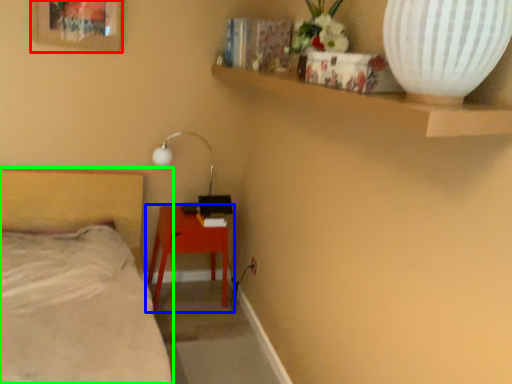
Question: Considering the real-world distances, which object is closest to picture frame (highlighted by a red box)? table (highlighted by a blue box) or bed (highlighted by a green box).

Choices:
 (A) table
 (B) bed

Answer: (B)